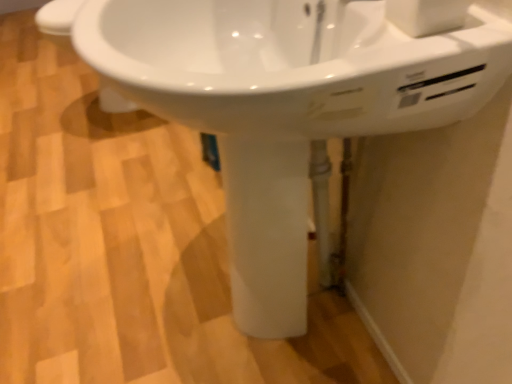
Where is `white glossy toilet bowl at lower left`? The image size is (512, 384). white glossy toilet bowl at lower left is located at coordinates (58, 19).

What do you see at coordinates (58, 19) in the screenshot?
I see `white glossy toilet bowl at lower left` at bounding box center [58, 19].

I want to click on white glossy toilet bowl at lower left, so click(58, 19).